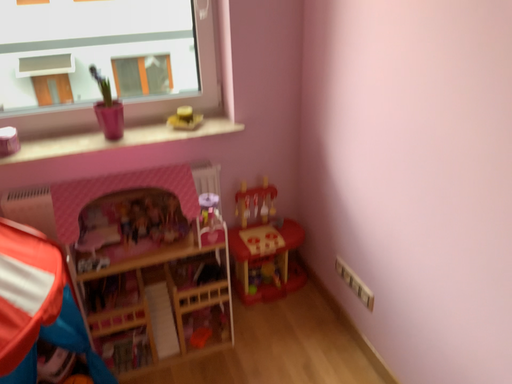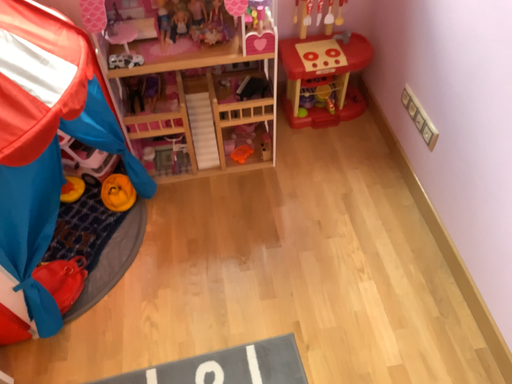
Question: How did the camera likely rotate when shooting the video?

Choices:
 (A) rotated downward
 (B) rotated upward

Answer: (A)